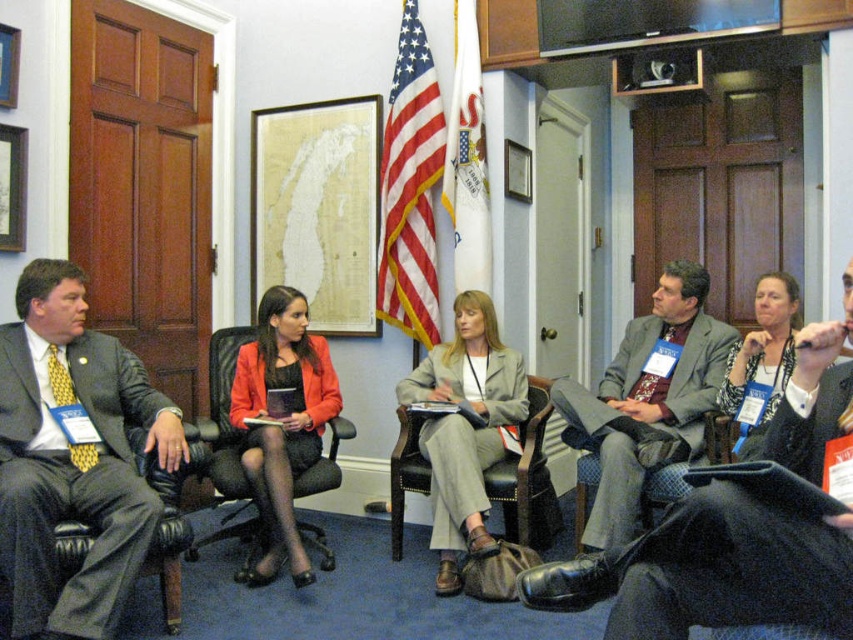
Question: Can you confirm if gray wool suit at center is bigger than metallic silver trophy at upper center?

Choices:
 (A) no
 (B) yes

Answer: (B)

Question: Which point is farther from the camera taking this photo?

Choices:
 (A) (720, 378)
 (B) (679, 70)
 (C) (262, 570)
 (D) (45, 620)

Answer: (B)

Question: Is matte black suit at left below metallic silver trophy at upper center?

Choices:
 (A) no
 (B) yes

Answer: (B)

Question: Which of the following is the closest to the observer?

Choices:
 (A) (642, 51)
 (B) (683, 435)

Answer: (B)

Question: Is matte red blazer at center to the left of plush fabric chair at center from the viewer's perspective?

Choices:
 (A) no
 (B) yes

Answer: (B)

Question: Which of the following is the closest to the observer?

Choices:
 (A) (701, 385)
 (B) (552, 492)
 (C) (596, 515)

Answer: (C)